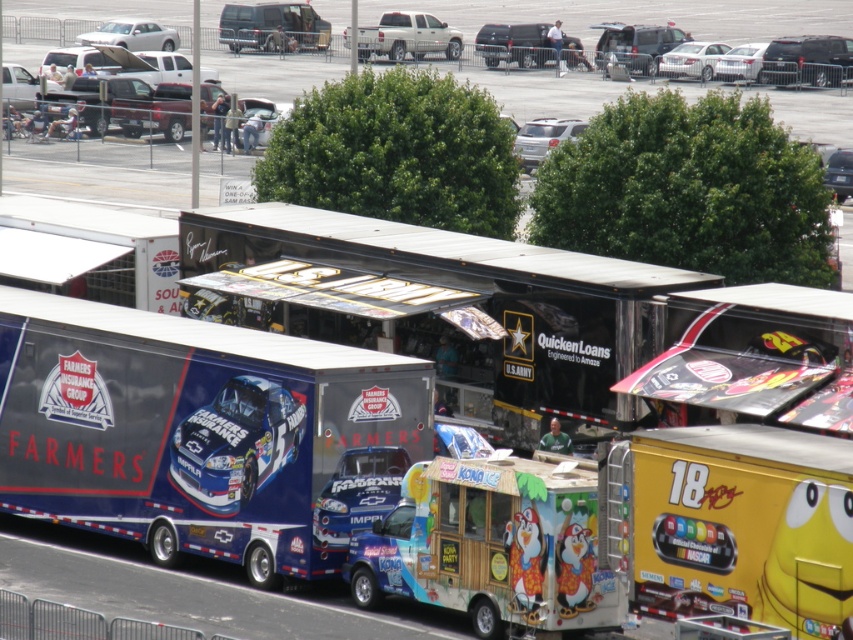
You are a photographer at the event and want to capture both the metallic silver truck at center and the silver metallic truck at center in a single shot. Since you are standing at the same level as their bases, which truck will appear taller in your photo?

The metallic silver truck at center is much taller as silver metallic truck at center, so it will appear taller in the photo.